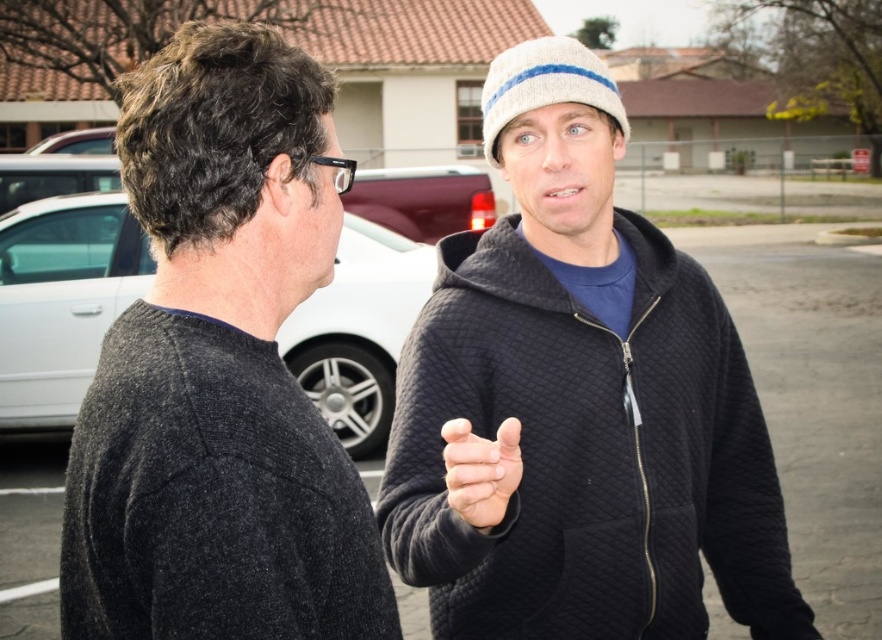
You are a delivery driver who needs to back out of the parking spot. There is a matte gray sedan at left and a matte red truck at center. Which vehicle is blocking your path?

The matte gray sedan at left is positioned under the matte red truck at center, so the matte red truck at center is blocking your path.

You are a delivery driver who needs to park your vehicle between the matte gray sedan at left and the matte red truck at center. Your truck is 1.8 meters wide. Can you fit your truck in the space between them?

The matte gray sedan at left is wider than the matte red truck at center. However, the exact width of the space between them isn t provided. Since the sedan is wider, the space might be narrower than the truck s width. It s uncertain if your 1.8 meter wide truck can fit without knowing the exact distance between them.